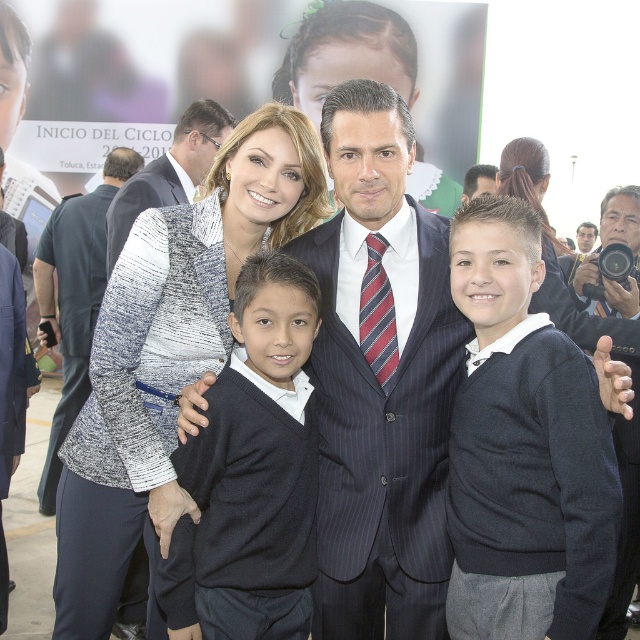
You are a photographer at the event and need to ensure that both the pinstriped wool suit at center and the white textured dress at center are clearly visible in the photo. Based on their positions, which one is closer to the camera?

The pinstriped wool suit at center is in front of the white textured dress at center, so it is closer to the camera.

You are a photographer standing at the back of the room. You want to take a photo of the white textured dress at center without anyone blocking it. The two boys on the sides are 5.74 meters apart. Can you position yourself in a way to capture the dress without obstruction?

The two boys on the sides are 5.74 meters apart, so if you position yourself directly behind the dress at center, you can capture it without obstruction as the distance between the boys allows a clear line of sight.

You are a photographer adjusting your camera settings to focus on the speckled knit sweater at center. Based on the coordinates provided, is the sweater positioned closer to the top or bottom half of the image?

The speckled knit sweater at center is located at point (x=168, y=356). Since the y coordinate is 0.264, which is less than 0.5, it is positioned closer to the bottom half of the image.